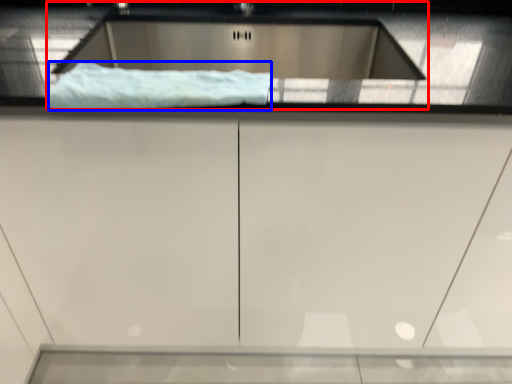
Question: Which object is closer to the camera taking this photo, sink (highlighted by a red box) or material (highlighted by a blue box)?

Choices:
 (A) sink
 (B) material

Answer: (B)